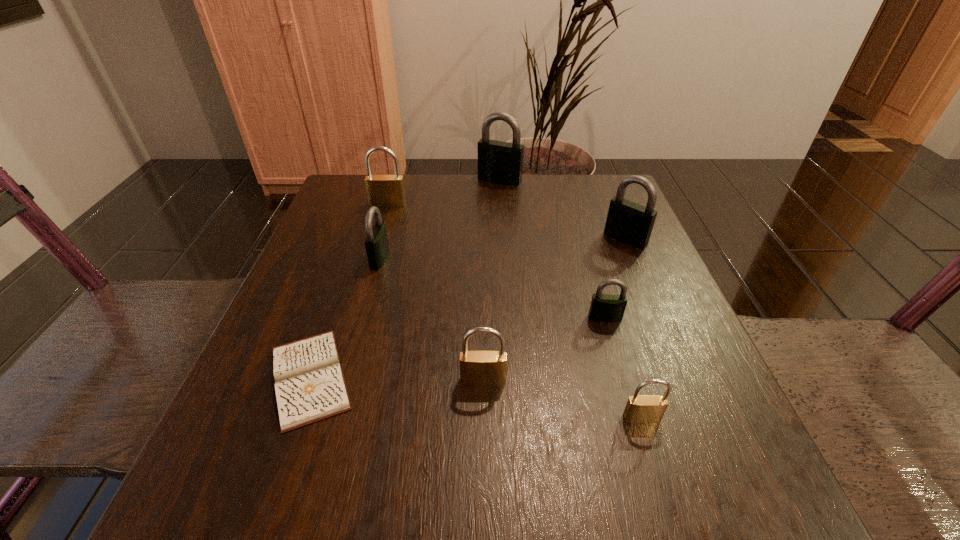
At what (x,y) coordinates should I click in order to perform the action: click on free space between the leftmost black padlock and the shortest object. Please return your answer as a coordinate pair (x, y). Looking at the image, I should click on (345, 318).

Identify the location of object that stands as the second closest to the farthest brass padlock. The width and height of the screenshot is (960, 540). (499, 162).

Locate which object ranks third in proximity to the second black padlock from right to left. Please provide its 2D coordinates. Your answer should be formatted as a tuple, i.e. [(x, y)], where the tuple contains the x and y coordinates of a point satisfying the conditions above.

[(477, 368)]

This screenshot has height=540, width=960. Find the location of `padlock that is the sixth closest to the second farthest brass padlock`. padlock that is the sixth closest to the second farthest brass padlock is located at coordinates (499, 162).

Image resolution: width=960 pixels, height=540 pixels. Find the location of `the fourth closest padlock relative to the second farthest padlock`. the fourth closest padlock relative to the second farthest padlock is located at coordinates (477, 368).

Locate which black padlock is the second closest to the diary. Please provide its 2D coordinates. Your answer should be formatted as a tuple, i.e. [(x, y)], where the tuple contains the x and y coordinates of a point satisfying the conditions above.

[(604, 307)]

At what (x,y) coordinates should I click in order to perform the action: click on the third closest black padlock relative to the second biggest brass padlock. Please return your answer as a coordinate pair (x, y). This screenshot has height=540, width=960. Looking at the image, I should click on (630, 223).

Select which brass padlock is the third closest to the fifth farthest object. Please provide its 2D coordinates. Your answer should be formatted as a tuple, i.e. [(x, y)], where the tuple contains the x and y coordinates of a point satisfying the conditions above.

[(386, 191)]

Where is `brass padlock that stands as the third closest to the rightmost object`? brass padlock that stands as the third closest to the rightmost object is located at coordinates (386, 191).